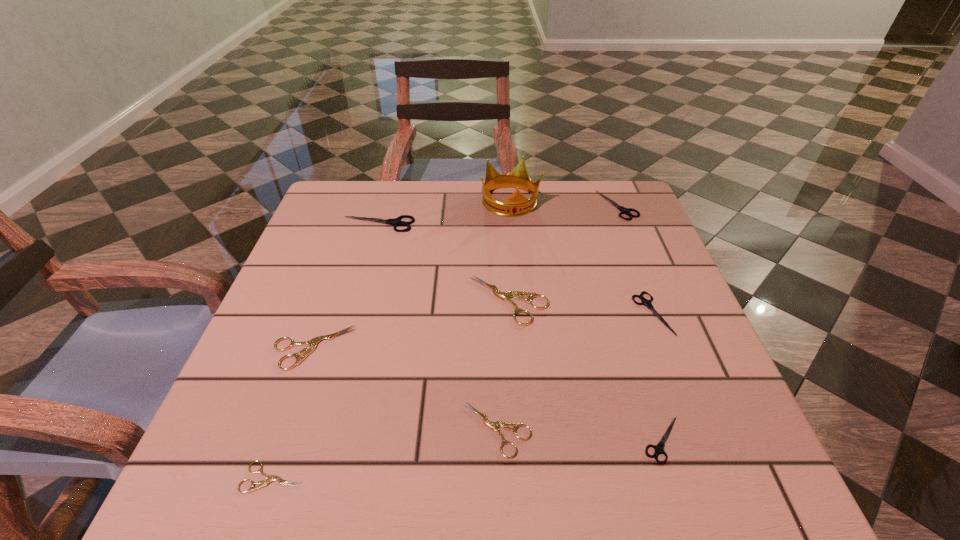
Find the location of a particular element. This screenshot has width=960, height=540. blank space located on the back of the shortest shears is located at coordinates (336, 291).

You are a GUI agent. You are given a task and a screenshot of the screen. Output one action in this format:
    pyautogui.click(x=<x>, y=<y>)
    Task: Click on the crown positioned at the far edge
    The width and height of the screenshot is (960, 540).
    Given the screenshot: What is the action you would take?
    pyautogui.click(x=516, y=204)

I want to click on object located at the far left corner, so click(x=395, y=222).

Where is `object located at the near left corner`? The width and height of the screenshot is (960, 540). object located at the near left corner is located at coordinates click(269, 478).

At what (x,y) coordinates should I click in order to perform the action: click on object that is at the far right corner. Please return your answer as a coordinate pair (x, y). Looking at the image, I should click on (623, 210).

Image resolution: width=960 pixels, height=540 pixels. What are the coordinates of `object that is positioned at the near right corner` in the screenshot? It's located at click(659, 448).

This screenshot has height=540, width=960. Identify the location of vacant point at the far edge. (452, 215).

What are the coordinates of `free spot at the left edge of the desktop` in the screenshot? It's located at (262, 416).

In the image, there is a desktop. At what (x,y) coordinates should I click in order to perform the action: click on free region at the right edge. Please return your answer as a coordinate pair (x, y). Looking at the image, I should click on (683, 309).

You are a GUI agent. You are given a task and a screenshot of the screen. Output one action in this format:
    pyautogui.click(x=<x>, y=<y>)
    Task: Click on the free space at the far right corner of the desktop
    
    Given the screenshot: What is the action you would take?
    pyautogui.click(x=612, y=225)